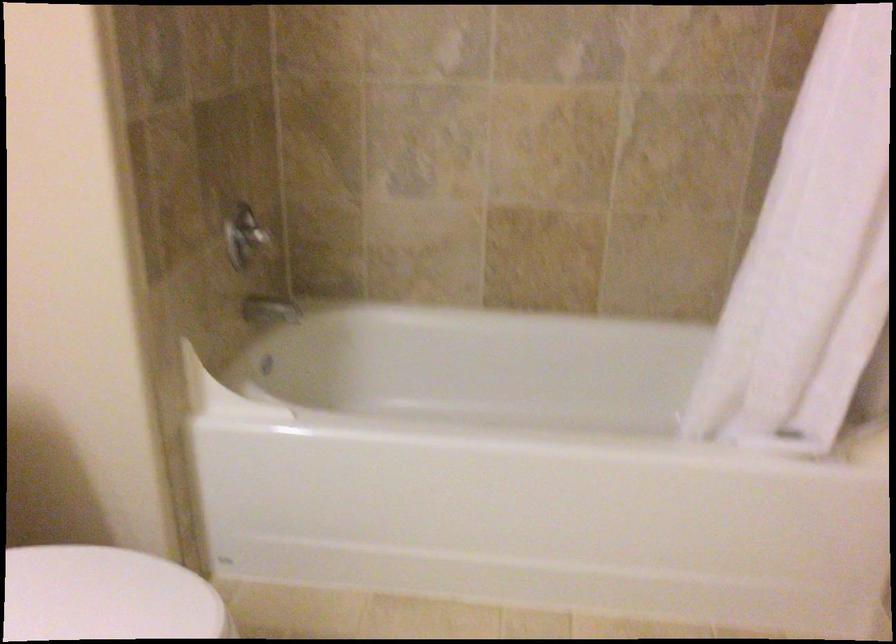
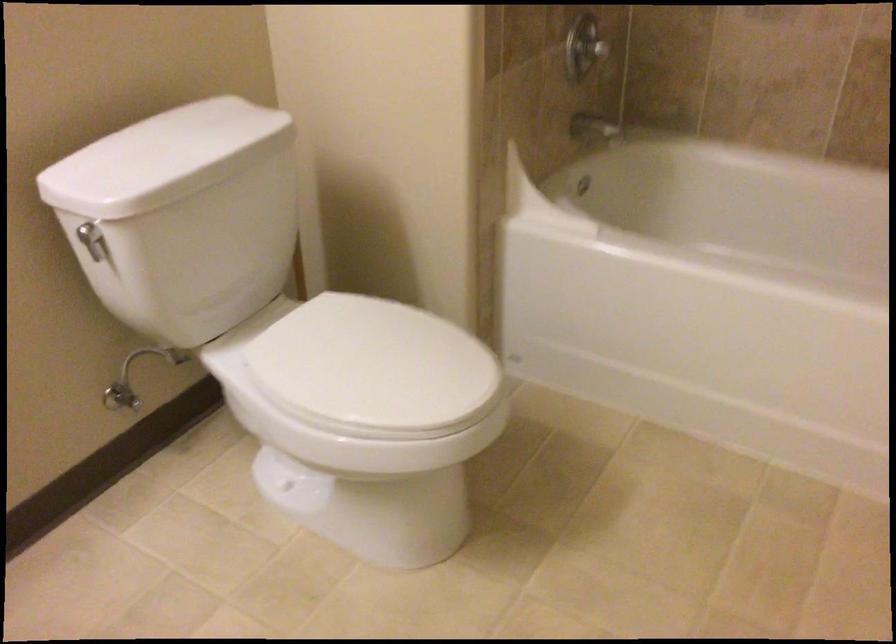
Question: The images are taken continuously from a first-person perspective. In which direction is your viewpoint rotating?

Choices:
 (A) Left
 (B) Right
 (C) Up
 (D) Down

Answer: (A)